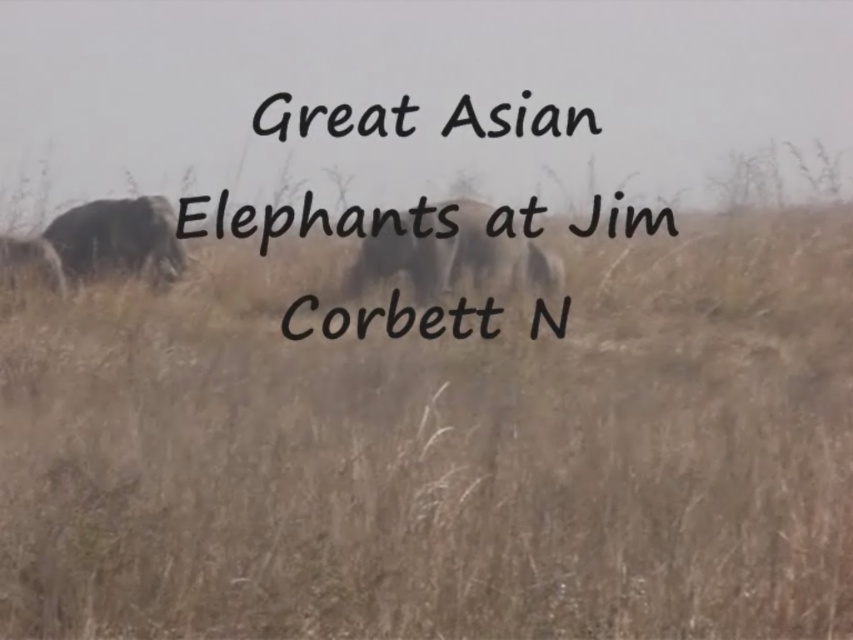
Question: Can you confirm if grayish-brown textured elephant at center is bigger than grayish-brown elephant at left?

Choices:
 (A) yes
 (B) no

Answer: (A)

Question: Estimate the real-world distances between objects in this image. Which object is closer to the grayish-brown textured elephant at center?

Choices:
 (A) grayish-brown elephant at left
 (B) gray textured elephant at left

Answer: (B)

Question: Does gray textured elephant at left appear over grayish-brown elephant at left?

Choices:
 (A) yes
 (B) no

Answer: (A)

Question: Which object appears farthest from the camera in this image?

Choices:
 (A) grayish-brown elephant at left
 (B) grayish-brown textured elephant at center

Answer: (B)

Question: Is grayish-brown textured elephant at center below grayish-brown elephant at left?

Choices:
 (A) yes
 (B) no

Answer: (B)

Question: Among these objects, which one is farthest from the camera?

Choices:
 (A) gray textured elephant at left
 (B) grayish-brown elephant at left

Answer: (A)